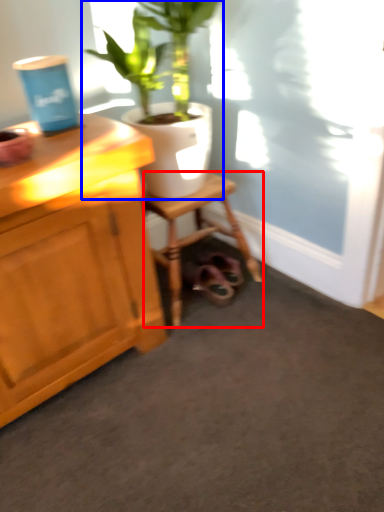
Question: Which object is further to the camera taking this photo, stool (highlighted by a red box) or houseplant (highlighted by a blue box)?

Choices:
 (A) stool
 (B) houseplant

Answer: (A)